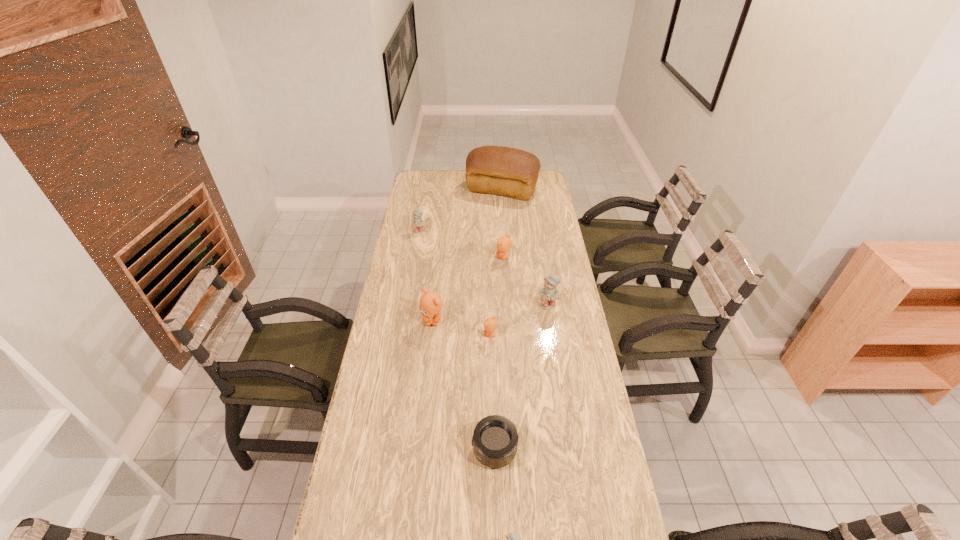
At what (x,y) coordinates should I click in order to perform the action: click on object that ranks as the sixth closest to the rightmost blue teddy bear. Please return your answer as a coordinate pair (x, y). Looking at the image, I should click on pyautogui.click(x=511, y=172).

This screenshot has height=540, width=960. What are the coordinates of `object that is the closest to the brown bread` in the screenshot? It's located at (417, 225).

Where is `the second closest teddy bear relative to the second farthest object`? the second closest teddy bear relative to the second farthest object is located at coordinates (430, 305).

Identify the location of teddy bear that stands as the third closest to the fifth nearest teddy bear. (430, 305).

This screenshot has height=540, width=960. Identify the location of blue teddy bear that stands as the closest to the second biggest blue teddy bear. (548, 294).

This screenshot has width=960, height=540. What are the coordinates of `blue teddy bear identified as the closest to the rightmost brown teddy bear` in the screenshot? It's located at (548, 294).

Where is `the closest brown teddy bear relative to the third farthest teddy bear`? The width and height of the screenshot is (960, 540). the closest brown teddy bear relative to the third farthest teddy bear is located at coordinates (490, 324).

Identify the location of the closest brown teddy bear to the brown bread. click(x=504, y=243).

Find the location of a particular element. This screenshot has height=540, width=960. vacant space that satisfies the following two spatial constraints: 1. on the face of the second farthest teddy bear; 2. on the face of the second farthest brown teddy bear is located at coordinates (508, 320).